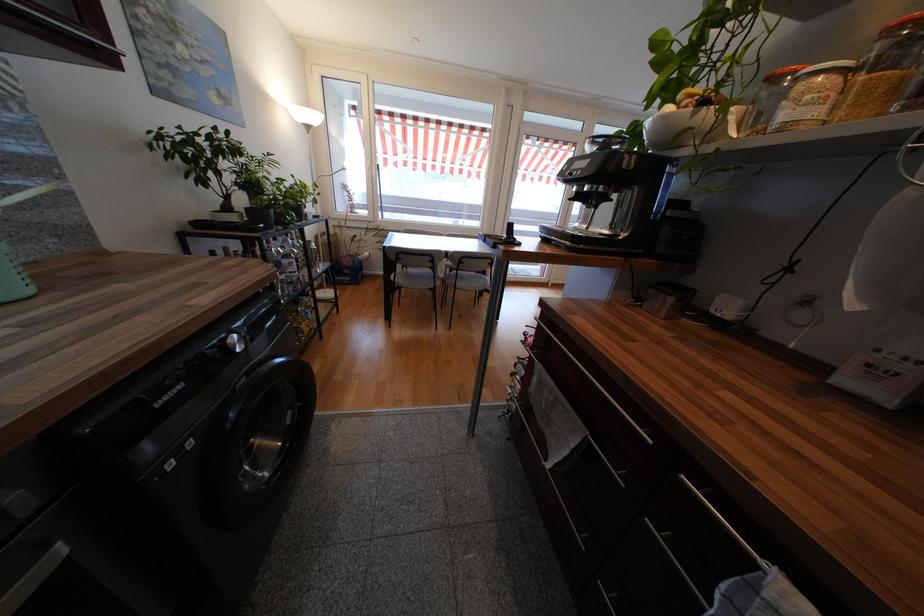
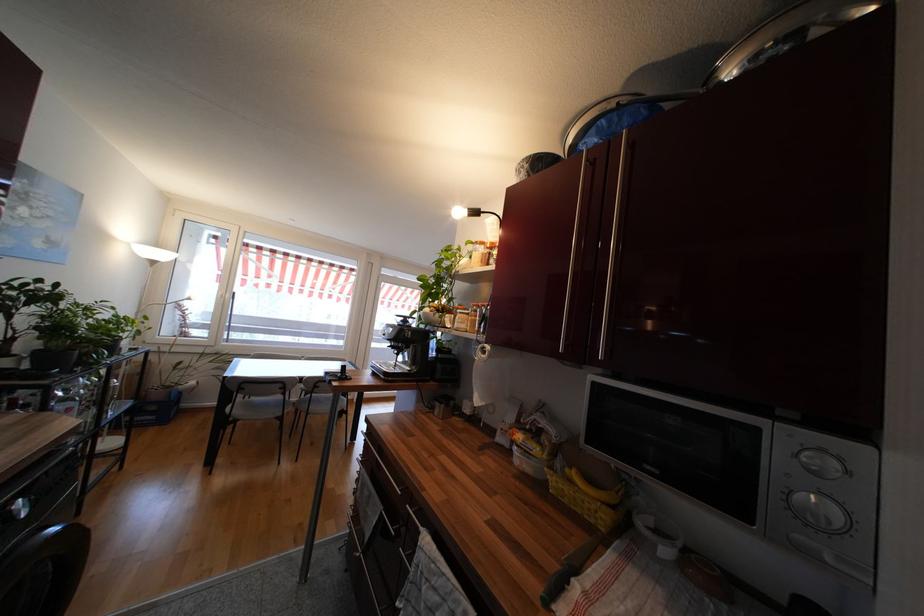
Find the pixel in the second image that matches the point at 345,283 in the first image.

(141, 424)